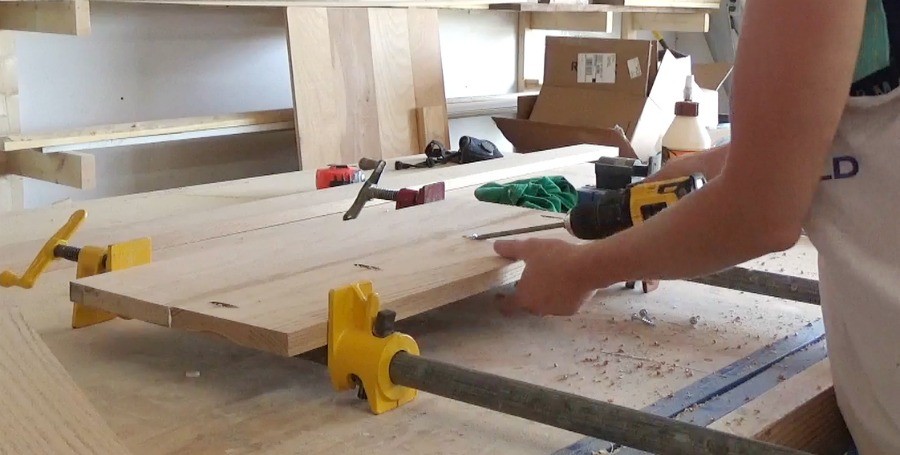
Where is `work table`? This screenshot has width=900, height=455. work table is located at coordinates (123, 399).